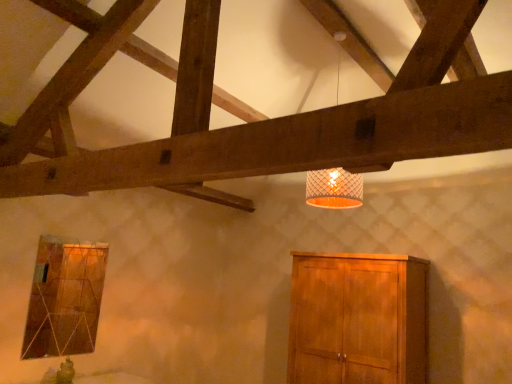
Question: Considering the positions of wooden cabinet at lower right and white mesh lampshade at upper center in the image, is wooden cabinet at lower right bigger or smaller than white mesh lampshade at upper center?

Choices:
 (A) big
 (B) small

Answer: (A)

Question: From the image's perspective, is wooden cabinet at lower right positioned above or below white mesh lampshade at upper center?

Choices:
 (A) above
 (B) below

Answer: (B)

Question: Which object is positioned farthest from the matte glass window at lower left?

Choices:
 (A) white mesh lampshade at upper center
 (B) wooden cabinet at lower right

Answer: (A)

Question: Which object is positioned closest to the wooden cabinet at lower right?

Choices:
 (A) white mesh lampshade at upper center
 (B) matte glass window at lower left

Answer: (A)